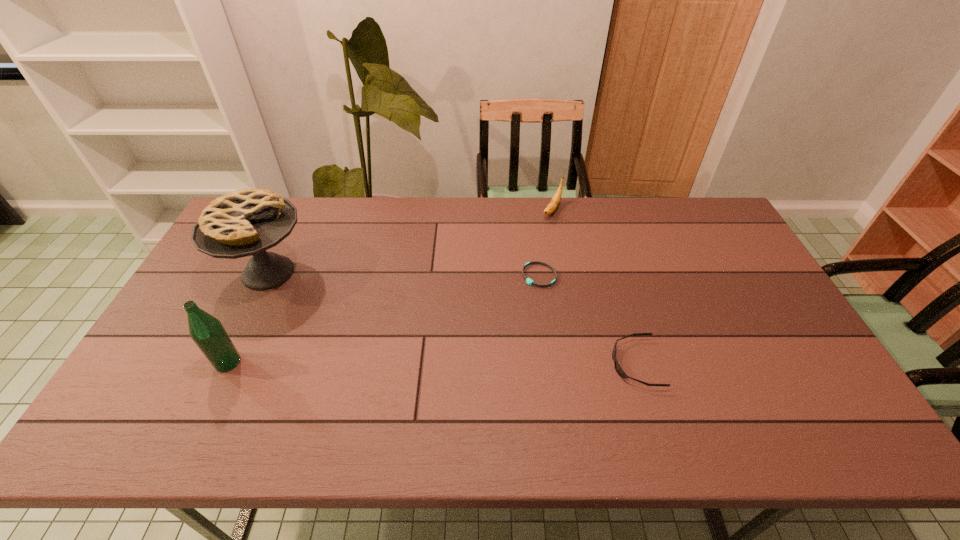
Find the location of a particular element. This screenshot has width=960, height=540. free space located 0.120m on the front-facing side of the rightmost object is located at coordinates (566, 363).

Locate an element on the screen. vacant space located on the buckle of the shortest object is located at coordinates (496, 323).

The height and width of the screenshot is (540, 960). Identify the location of vacant space located 0.340m on the buckle of the shortest object. (461, 362).

Identify the location of vacant space located 0.390m on the buckle of the shortest object. (448, 375).

Locate an element on the screen. This screenshot has width=960, height=540. vacant space located 0.360m on the peel of the farthest object from the top is located at coordinates (508, 288).

Identify the location of vacant region located 0.180m on the peel of the farthest object from the top. (530, 252).

Locate an element on the screen. blank area located on the peel of the farthest object from the top is located at coordinates (533, 248).

This screenshot has height=540, width=960. Identify the location of free space located 0.130m on the cut side of the pie. (324, 313).

Where is `free space located on the cut side of the pie`? The image size is (960, 540). free space located on the cut side of the pie is located at coordinates (364, 342).

I want to click on free region located on the cut side of the pie, so click(x=354, y=335).